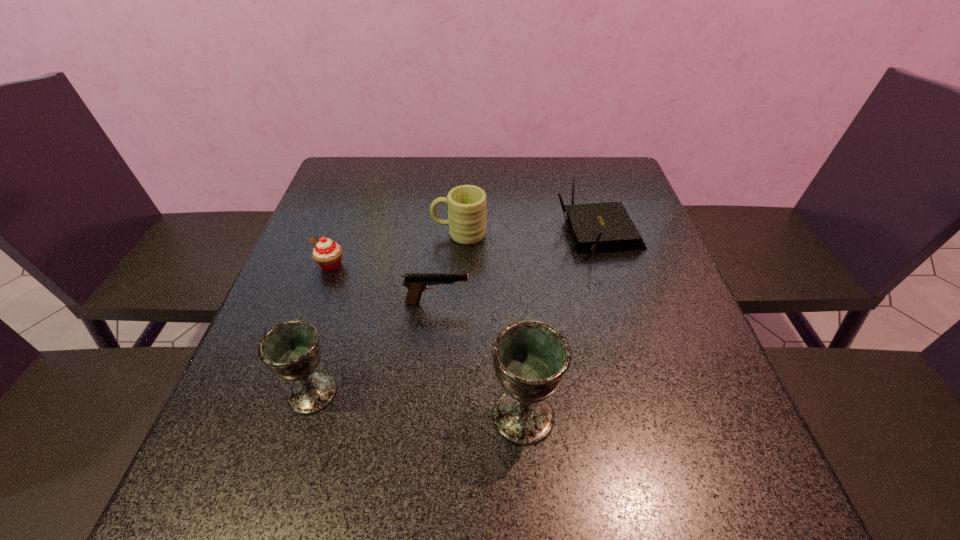
Where is `the shorter chalice`? The image size is (960, 540). the shorter chalice is located at coordinates (291, 350).

This screenshot has width=960, height=540. Find the location of `the second tallest object`. the second tallest object is located at coordinates (291, 350).

Locate an element on the screen. Image resolution: width=960 pixels, height=540 pixels. the taller chalice is located at coordinates (531, 358).

Identify the location of the fifth object from left to right. (531, 358).

This screenshot has height=540, width=960. What are the coordinates of `mug` in the screenshot? It's located at (467, 212).

Where is `the fourth farthest object`? Image resolution: width=960 pixels, height=540 pixels. the fourth farthest object is located at coordinates (416, 283).

Find the location of `router`. router is located at coordinates (599, 227).

You are a GUI agent. You are given a task and a screenshot of the screen. Output one action in this format:
    pyautogui.click(x=<x>, y=<y>)
    Task: Click on the cupcake
    
    Given the screenshot: What is the action you would take?
    pyautogui.click(x=327, y=254)

At what (x,y) coordinates should I click in order to perform the action: click on vacant space situated on the left of the left chalice. Please return your answer as a coordinate pair (x, y). Looking at the image, I should click on (253, 393).

Where is `free space located 0.400m on the back of the tallest object`? free space located 0.400m on the back of the tallest object is located at coordinates (511, 246).